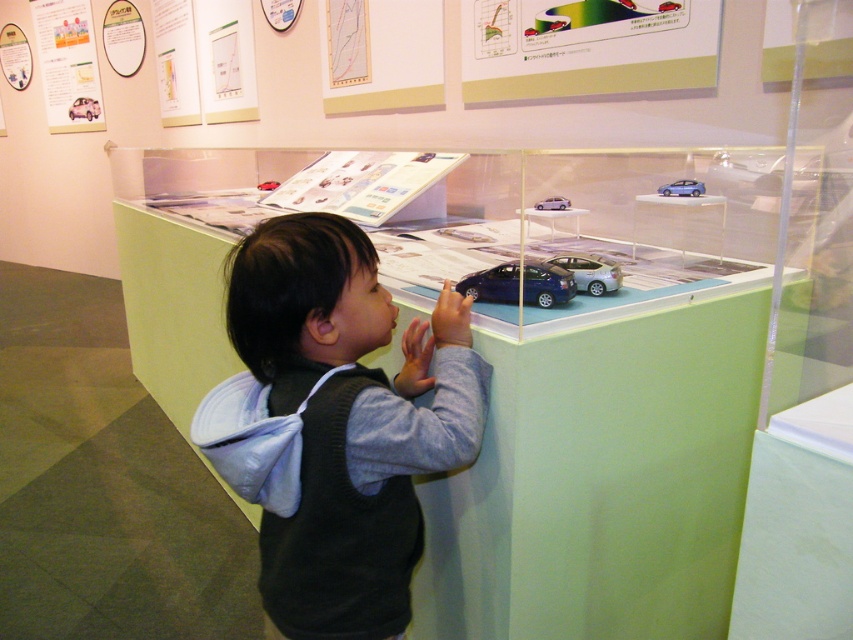
Who is shorter, satin blue car at center or satin purple car at center?

With less height is satin purple car at center.

Looking at this image, is the position of satin blue car at center more distant than that of satin purple car at center?

No, satin blue car at center is closer to the viewer.

Between point (524, 294) and point (556, 202), which one is positioned in front?

Point (524, 294) is more forward.

In order to click on satin blue car at center in this screenshot , I will do `click(546, 284)`.

Is the position of satin blue car at center more distant than that of satin silver car at center?

No, it is in front of satin silver car at center.

Is satin blue car at center above satin silver car at center?

No.

Is point (561, 276) positioned behind point (583, 269)?

No, (561, 276) is in front of (583, 269).

Locate an element on the screen. The image size is (853, 640). satin blue car at center is located at coordinates pos(546,284).

Who is more forward, (401, 467) or (561, 208)?

Point (401, 467) is more forward.

You are a GUI agent. You are given a task and a screenshot of the screen. Output one action in this format:
    pyautogui.click(x=<x>, y=<y>)
    Task: Click on the gray fleece vest at center
    The width and height of the screenshot is (853, 640).
    Given the screenshot: What is the action you would take?
    tap(335, 424)